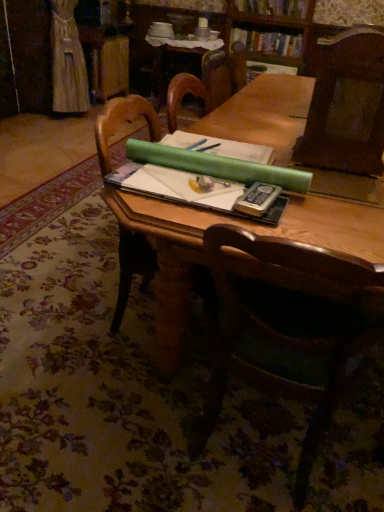
Where is `vacant area that is in front of dark wood chair at upper right, the first chair when ordered from top to bottom`? Image resolution: width=384 pixels, height=512 pixels. vacant area that is in front of dark wood chair at upper right, the first chair when ordered from top to bottom is located at coordinates (339, 187).